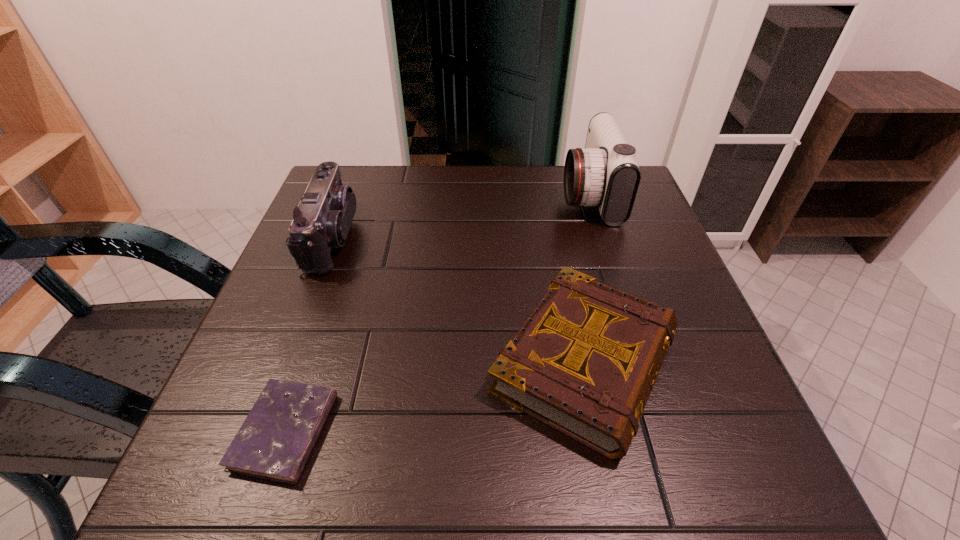
You are a GUI agent. You are given a task and a screenshot of the screen. Output one action in this format:
    pyautogui.click(x=<x>, y=<y>)
    Task: Click on the free space between the hardback book and the left camcorder
    
    Given the screenshot: What is the action you would take?
    pyautogui.click(x=459, y=300)

Where is `unoccupied position between the diary and the left camcorder`? The image size is (960, 540). unoccupied position between the diary and the left camcorder is located at coordinates (309, 334).

Where is `free area in between the shorter camcorder and the second shortest object`? The image size is (960, 540). free area in between the shorter camcorder and the second shortest object is located at coordinates (459, 300).

Locate an element on the screen. The height and width of the screenshot is (540, 960). empty location between the left camcorder and the shortest object is located at coordinates (309, 334).

You are a GUI agent. You are given a task and a screenshot of the screen. Output one action in this format:
    pyautogui.click(x=<x>, y=<y>)
    Task: Click on the unoccupied position between the taller camcorder and the shorter camcorder
    The width and height of the screenshot is (960, 540).
    Given the screenshot: What is the action you would take?
    pyautogui.click(x=461, y=216)

The width and height of the screenshot is (960, 540). I want to click on free space that is in between the shorter camcorder and the diary, so click(309, 334).

You are a GUI agent. You are given a task and a screenshot of the screen. Output one action in this format:
    pyautogui.click(x=<x>, y=<y>)
    Task: Click on the object that stands as the second closest to the shorter camcorder
    The width and height of the screenshot is (960, 540).
    Given the screenshot: What is the action you would take?
    pyautogui.click(x=585, y=361)

The width and height of the screenshot is (960, 540). In order to click on object that is the closest to the shortest object in this screenshot , I will do `click(585, 361)`.

The height and width of the screenshot is (540, 960). Identify the location of blank space that satisfies the following two spatial constraints: 1. on the front-facing side of the shorter camcorder; 2. on the right side of the shortest object. (258, 431).

What are the coordinates of `vacant space that satisfies the following two spatial constraints: 1. on the back side of the shortest object; 2. on the front-facing side of the third shortest object` in the screenshot? It's located at (350, 237).